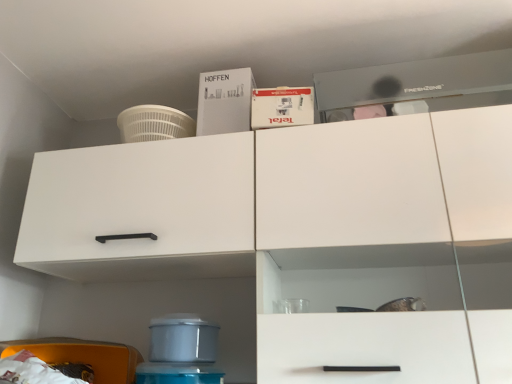
Question: Does white matte box at upper center, placed as the 2th box when sorted from front to back, have a lesser height compared to white matte cabinet at left?

Choices:
 (A) yes
 (B) no

Answer: (A)

Question: Considering the relative sizes of white matte box at upper center, the 2th box positioned from the right, and white matte cabinet at left in the image provided, is white matte box at upper center, the 2th box positioned from the right, smaller than white matte cabinet at left?

Choices:
 (A) yes
 (B) no

Answer: (A)

Question: Is white matte box at upper center, placed as the 2th box when sorted from front to back, positioned behind white matte cabinet at left?

Choices:
 (A) yes
 (B) no

Answer: (A)

Question: From a real-world perspective, does white matte box at upper center, which is the 1th box in left-to-right order, stand above white matte cabinet at left?

Choices:
 (A) no
 (B) yes

Answer: (B)

Question: Is white matte box at upper center, placed as the 2th box when sorted from front to back, not near white matte cabinet at left?

Choices:
 (A) yes
 (B) no

Answer: (B)

Question: From the image's perspective, is white matte box at upper center, the 2th box positioned from the right, below white matte cabinet at left?

Choices:
 (A) yes
 (B) no

Answer: (B)

Question: Are white matte cabinet at left and white matte box at upper center, which is the 1th box in left-to-right order, beside each other?

Choices:
 (A) no
 (B) yes

Answer: (A)

Question: Considering the relative sizes of white matte cabinet at left and white matte box at upper center, the 1th box in the back-to-front sequence, in the image provided, is white matte cabinet at left taller than white matte box at upper center, the 1th box in the back-to-front sequence,?

Choices:
 (A) yes
 (B) no

Answer: (A)

Question: Does white matte cabinet at left have a lesser width compared to white matte box at upper center, the 1th box in the back-to-front sequence?

Choices:
 (A) no
 (B) yes

Answer: (A)

Question: Is white matte cabinet at left bigger than white matte box at upper center, placed as the 2th box when sorted from front to back?

Choices:
 (A) yes
 (B) no

Answer: (A)

Question: Would you say white matte cabinet at left is a long distance from white matte box at upper center, the 1th box in the back-to-front sequence?

Choices:
 (A) yes
 (B) no

Answer: (B)

Question: From a real-world perspective, is white matte cabinet at left under white matte box at upper center, the 2th box positioned from the right?

Choices:
 (A) no
 (B) yes

Answer: (B)

Question: Are white matte cabinet at left and white cardboard box at upper center, which is the first box in right-to-left order, beside each other?

Choices:
 (A) yes
 (B) no

Answer: (B)